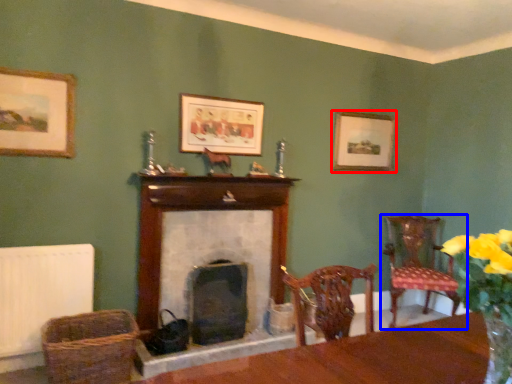
Question: Which point is closer to the camera, picture frame (highlighted by a red box) or chair (highlighted by a blue box)?

Choices:
 (A) picture frame
 (B) chair

Answer: (B)